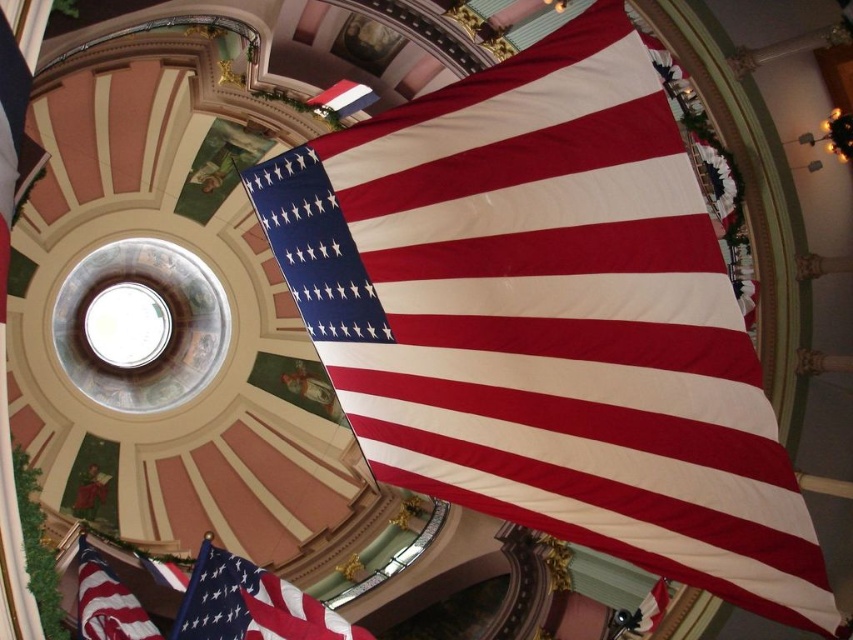
You are a visitor standing in the center of the hall and see the matte fabric flag at lower left and the matte red flag at lower left. Which flag is located more to the left side?

The matte fabric flag at lower left is more to the left side than the matte red flag at lower left.

You are a photographer standing in the grand hall and want to take a closeup shot of the matte fabric flag at center. Considering your camera can focus on subjects within 10 meters, will you be able to take the closeup without moving closer?

The distance between the matte fabric flag at center and the camera is 36.10 meters, which is beyond the camera focus range of 10 meters. Therefore, you cannot take the closeup without moving closer.

You are an event planner setting up for a ceremony in this grand hall. You need to place a 40 meter long red carpet from the entrance to the stage. There are two matte fabric flags in the room. Can you fit the carpet between the matte fabric flag at center and the matte fabric flag at lower left without overlapping them?

The distance between the matte fabric flag at center and the matte fabric flag at lower left is 39.01 meters. Since the red carpet is 40 meters long, it is slightly longer than the space between them. Therefore, the carpet cannot be placed between them without overlapping the flags.